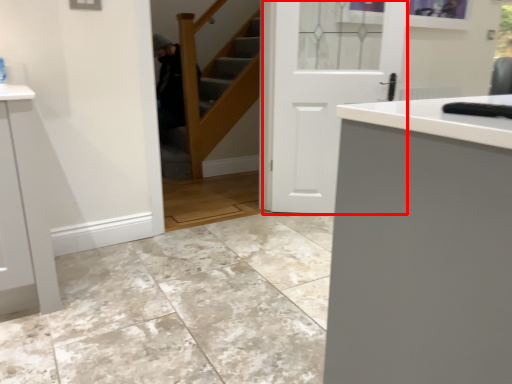
Question: From the image's perspective, where is door (annotated by the red box) located in relation to stairwell in the image?

Choices:
 (A) above
 (B) below

Answer: (B)